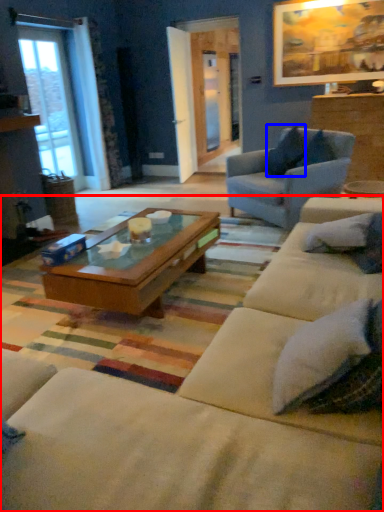
Question: Among these objects, which one is farthest to the camera, studio couch (highlighted by a red box) or pillow (highlighted by a blue box)?

Choices:
 (A) studio couch
 (B) pillow

Answer: (B)